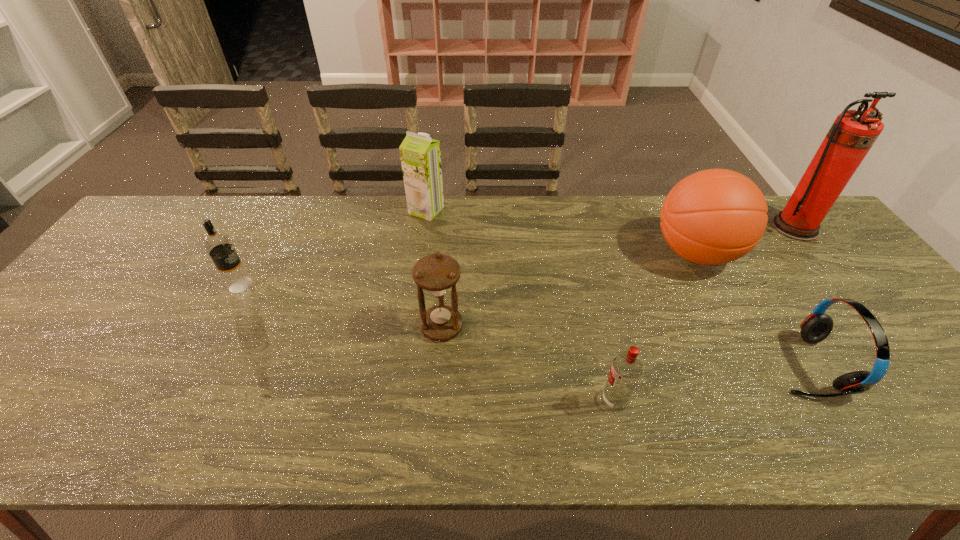
Locate an element on the screen. The width and height of the screenshot is (960, 540). the tallest object is located at coordinates (853, 133).

You are a GUI agent. You are given a task and a screenshot of the screen. Output one action in this format:
    pyautogui.click(x=<x>, y=<y>)
    Task: Click on the rightmost object
    The width and height of the screenshot is (960, 540).
    Given the screenshot: What is the action you would take?
    pyautogui.click(x=853, y=133)

The height and width of the screenshot is (540, 960). Identify the location of soya milk. tap(420, 155).

This screenshot has height=540, width=960. Find the location of `basketball`. basketball is located at coordinates 715,216.

Find the location of `the left vodka`. the left vodka is located at coordinates (236, 279).

Locate an element on the screen. the taller vodka is located at coordinates (236, 279).

This screenshot has height=540, width=960. I want to click on hourglass, so click(x=436, y=273).

I want to click on the fourth object from right to left, so click(x=626, y=369).

Locate an element on the screen. The image size is (960, 540). the right vodka is located at coordinates [626, 369].

This screenshot has height=540, width=960. Identify the location of headset. (817, 326).